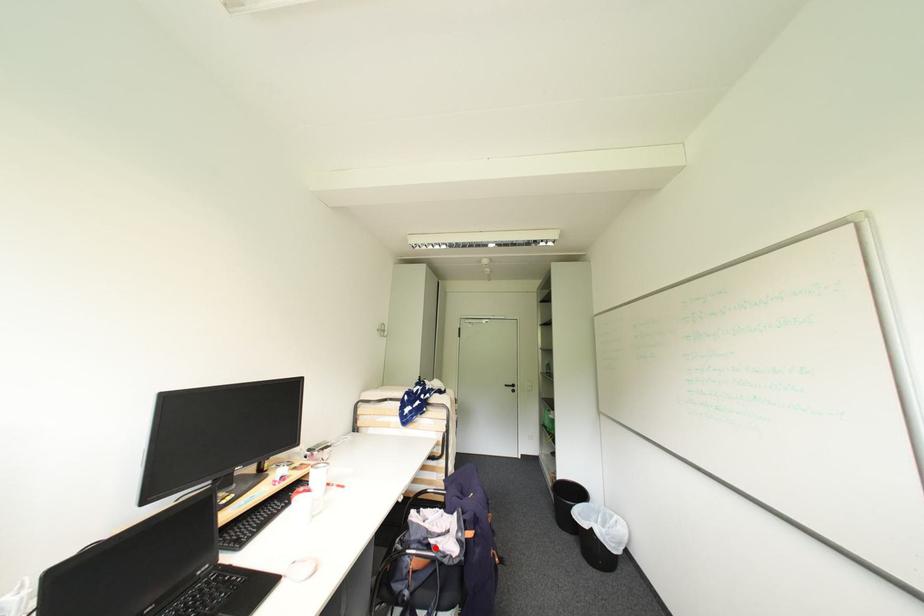
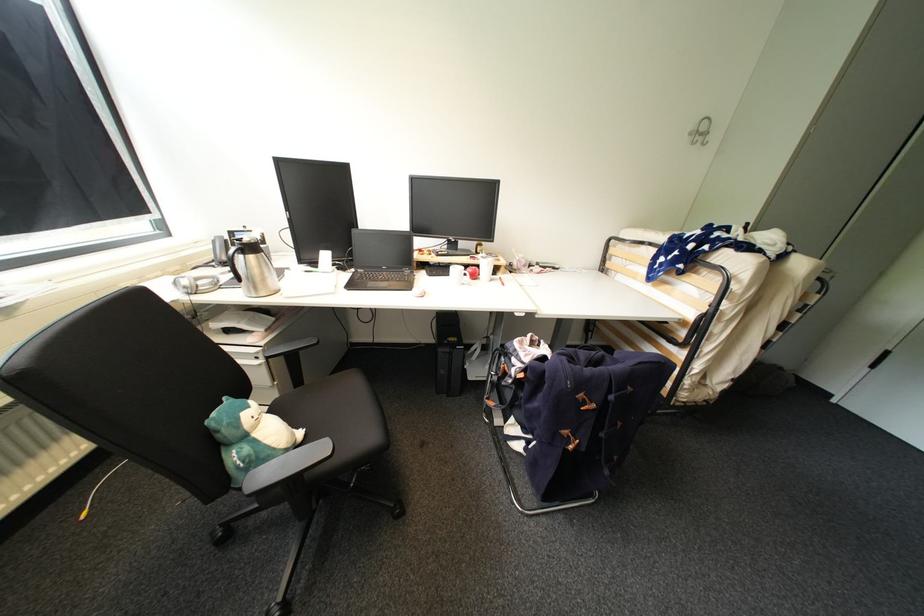
Question: I am providing you with two images of the same scene from different viewpoints. A red point is marked on the first image. Is the red point's position out of view in image 2?

Choices:
 (A) Yes
 (B) No

Answer: (A)